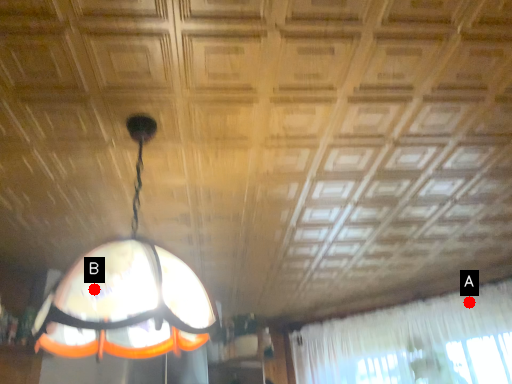
Question: Two points are circled on the image, labeled by A and B beside each circle. Which point is farther from the camera taking this photo?

Choices:
 (A) A is further
 (B) B is further

Answer: (A)